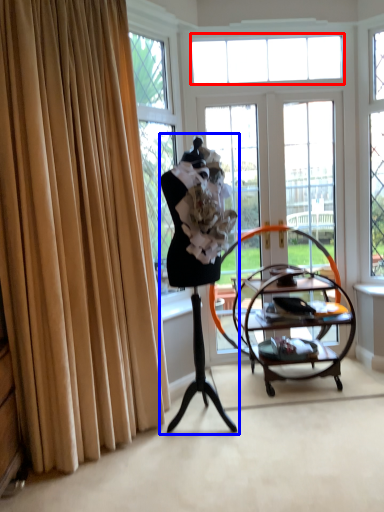
Question: Which object is further to the camera taking this photo, window (highlighted by a red box) or woman (highlighted by a blue box)?

Choices:
 (A) window
 (B) woman

Answer: (A)